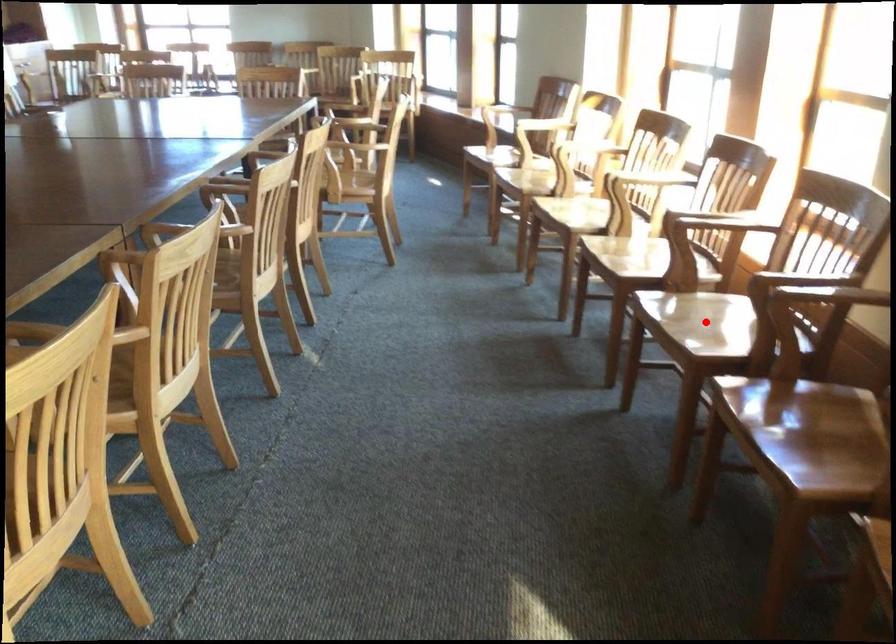
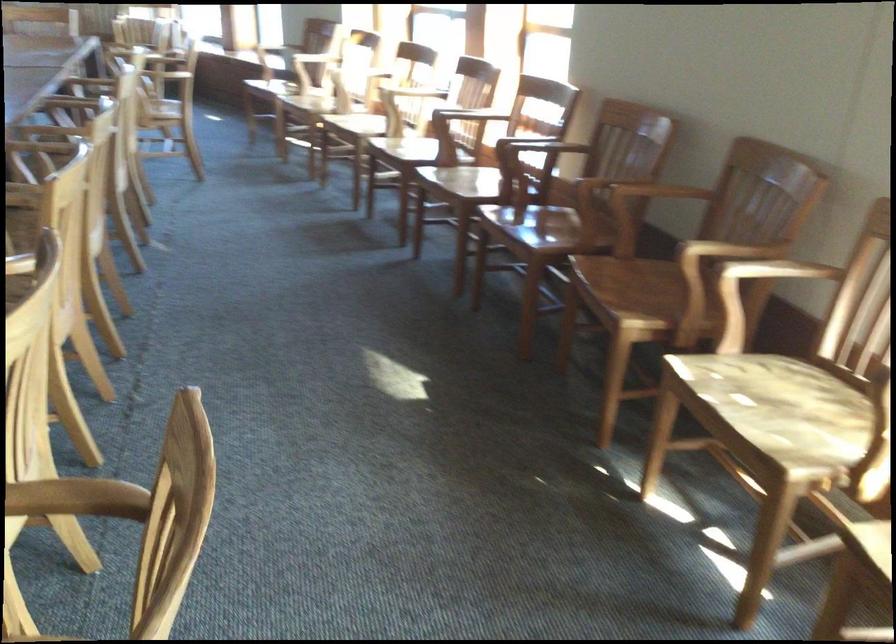
In the second image, find the point that corresponds to the highlighted location in the first image.

(470, 180)